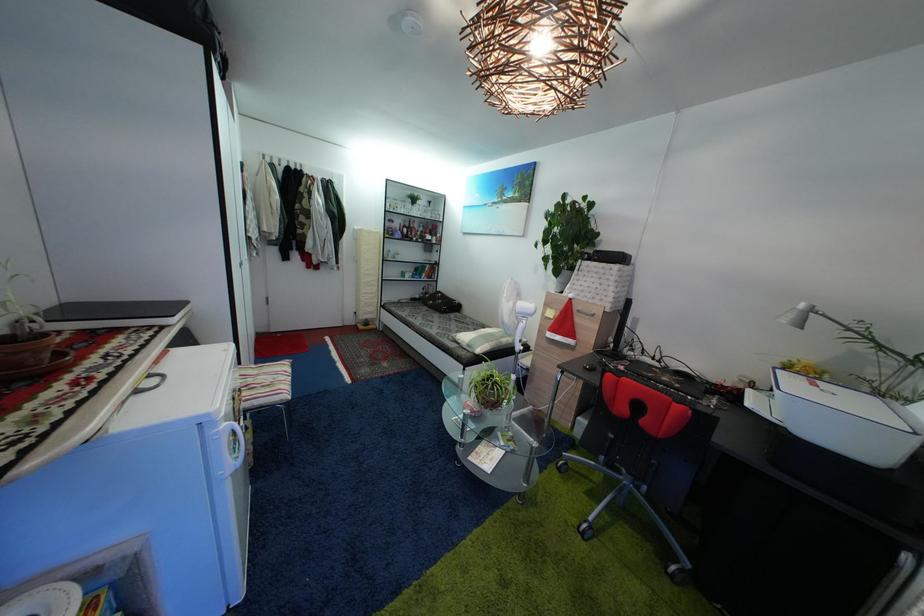
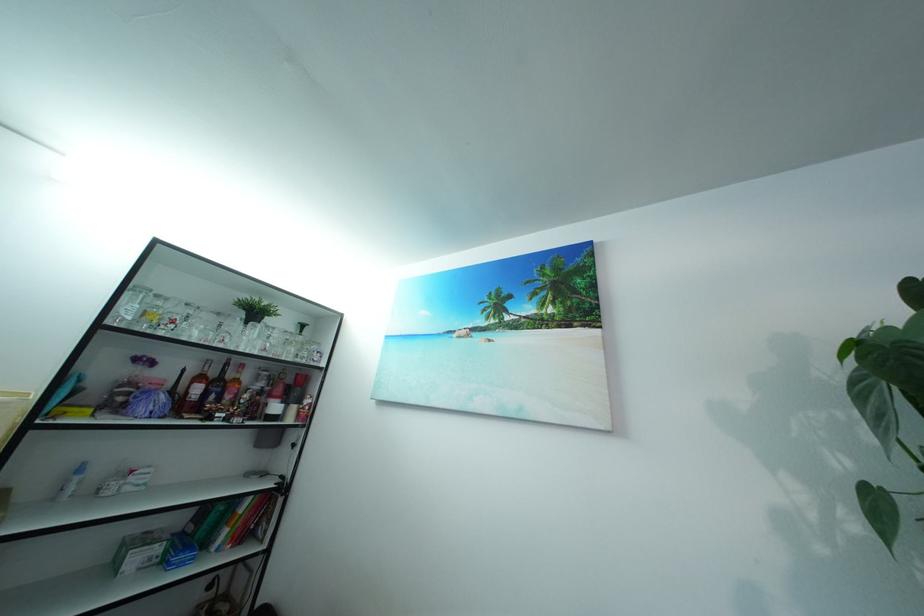
Find the pixel in the second image that matches pixel 431 238 in the first image.

(269, 400)